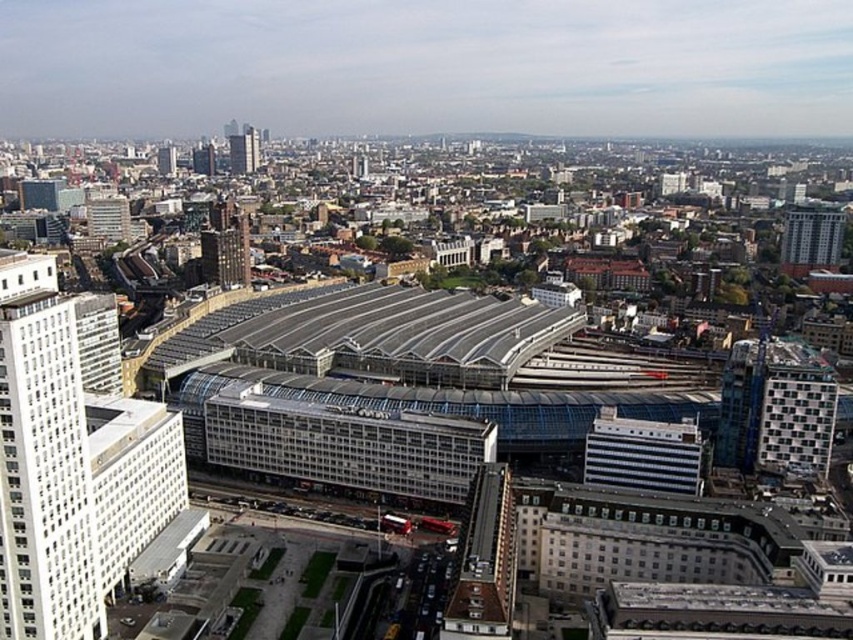
Question: Which object is closer to the camera taking this photo?

Choices:
 (A) white glass building at center-right
 (B) white glass building at upper left
 (C) metallic silver tower at center
 (D) white glass building at left

Answer: (D)

Question: Considering the real-world distances, which object is closest to the white glass building at left?

Choices:
 (A) white glass building at upper left
 (B) white glass skyscraper at upper right

Answer: (B)

Question: Can you confirm if white glass building at left is smaller than white glass building at center-right?

Choices:
 (A) yes
 (B) no

Answer: (B)

Question: Is white glass skyscraper at upper right positioned before dark gray concrete building at center-left?

Choices:
 (A) no
 (B) yes

Answer: (A)

Question: Is metallic silver tower at center behind white glass skyscraper at upper right?

Choices:
 (A) no
 (B) yes

Answer: (A)

Question: Based on their relative distances, which object is nearer to the white glass building at upper left?

Choices:
 (A) white glass skyscraper at upper right
 (B) white glass building at center-right

Answer: (A)